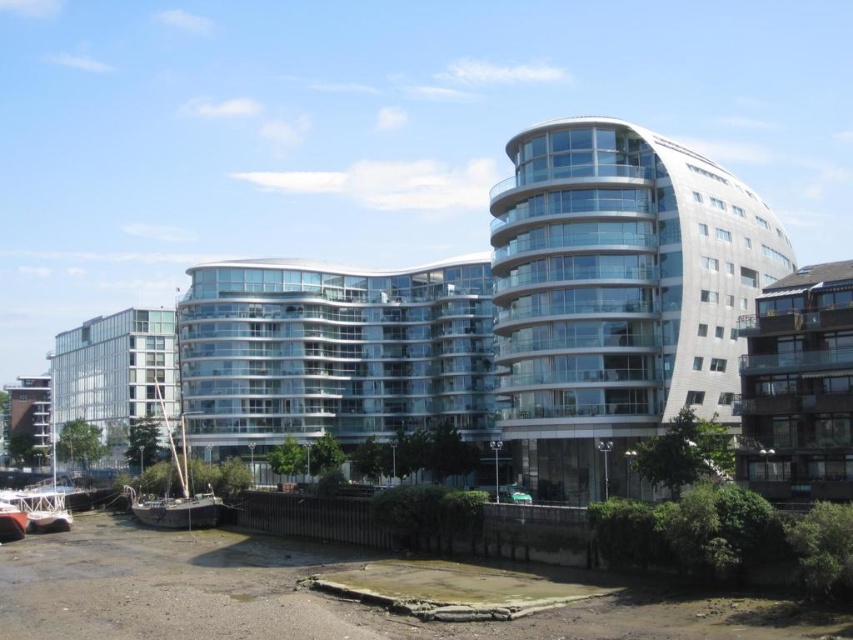
You are an architect evaluating the modern architectural complex. You need to determine which building is taller between the glassy white building at center and the transparent glass building at center. Based on the scene, which one is taller?

The glassy white building at center is taller than the transparent glass building at center according to the description.

Consider the image. You are a visitor standing in front of the waterfront area. You see the glassy white building at center and the transparent glass building at center. Which one is positioned to the right side?

The glassy white building at center is to the right of the transparent glass building at center, so the glassy white building at center is positioned to the right side.

You are standing at the point marked by the coordinates point (618, 296) in the image. Which building are you facing? Please answer with the object label from the scene description.

The point (618, 296) indicates glassy white building at center, so you are facing the glassy white building at center.